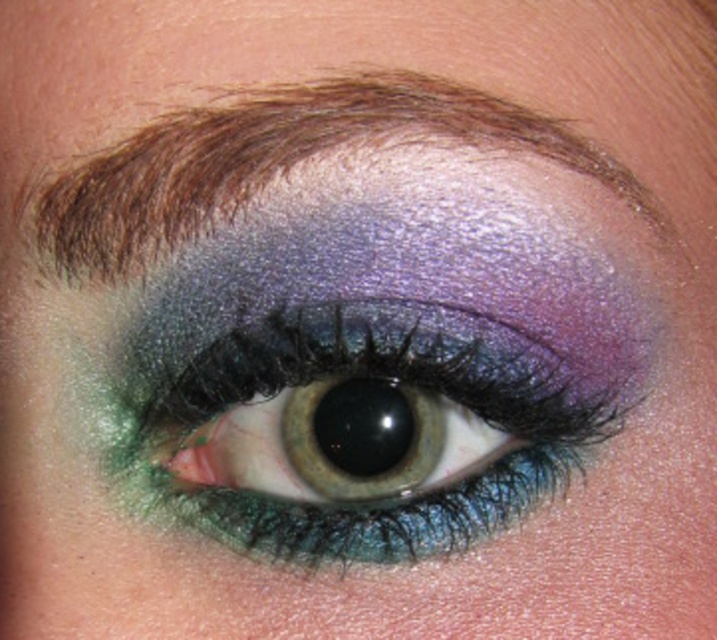
You are a photographer using a camera with a focal length of 50mm. You want to capture a closeup of the shimmering metallic eye at center. If the recommended distance for optimal focus is between 10 to 15 inches, is the current distance suitable?

The shimmering metallic eye at center is 12.84 inches away from the camera, which falls within the recommended 10 to 15 inches range. Therefore, the current distance is suitable for optimal focus.

You are a makeup artist trying to apply eyeliner on the shimmering metallic eye at center and the shiny brown eyebrow at upper center. Which area requires more precise application due to its size?

The shiny brown eyebrow at upper center requires more precise application because it is smaller than the shimmering metallic eye at center.

You are a makeup artist preparing to apply eyeliner. You notice the shimmering metallic eye at center and the shiny brown eyebrow at upper center. Which of these two features is taller in the image?

The shimmering metallic eye at center is much taller than the shiny brown eyebrow at upper center.